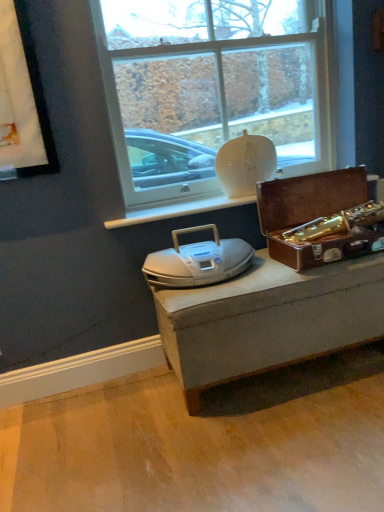
What do you see at coordinates (320, 218) in the screenshot?
I see `shiny brown suitcase at right` at bounding box center [320, 218].

Image resolution: width=384 pixels, height=512 pixels. Identify the location of white matte vase at upper center. (211, 88).

Locate an element on the screen. shiny brown suitcase at right is located at coordinates (320, 218).

Is there a large distance between white plastic stereo at center and white matte vase at upper center?

Actually, white plastic stereo at center and white matte vase at upper center are a little close together.

Is white matte vase at upper center completely or partially inside white plastic stereo at center?

Definitely not — white matte vase at upper center is not inside white plastic stereo at center.

Does point (227, 243) come behind point (248, 4)?

No, (227, 243) is closer to viewer.

Is white plastic stereo at center at the left side of white matte vase at upper center?

Yes, white plastic stereo at center is to the left of white matte vase at upper center.

Do you think shiny brown suitcase at right is within white plastic stereo at center, or outside of it?

shiny brown suitcase at right is not inside white plastic stereo at center, it's outside.

In terms of width, does shiny brown suitcase at right look wider or thinner when compared to white plastic stereo at center?

Clearly, shiny brown suitcase at right has more width compared to white plastic stereo at center.

Is shiny brown suitcase at right looking in the opposite direction of white plastic stereo at center?

shiny brown suitcase at right does not have its back to white plastic stereo at center.

Does point (333, 236) come farther from viewer compared to point (242, 258)?

No, (333, 236) is in front of (242, 258).

Is white matte vase at upper center oriented towards shiny brown suitcase at right?

Yes, white matte vase at upper center is oriented towards shiny brown suitcase at right.

Is white matte vase at upper center spatially inside shiny brown suitcase at right, or outside of it?

white matte vase at upper center is spatially situated outside shiny brown suitcase at right.

How different are the orientations of white matte vase at upper center and shiny brown suitcase at right in degrees?

white matte vase at upper center and shiny brown suitcase at right are facing 0.221 degrees away from each other.

Based on the photo, which object is positioned more to the left, white matte vase at upper center or shiny brown suitcase at right?

Positioned to the left is white matte vase at upper center.

Could you tell me if white plastic stereo at center is facing shiny brown suitcase at right?

No.

Is white plastic stereo at center wider than shiny brown suitcase at right?

No.

How much distance is there between white plastic stereo at center and shiny brown suitcase at right?

white plastic stereo at center and shiny brown suitcase at right are 16.26 inches apart.

Image resolution: width=384 pixels, height=512 pixels. What are the coordinates of `window behind the shiny brown suitcase at right` in the screenshot? It's located at (211, 88).

Is shiny brown suitcase at right oriented away from white matte vase at upper center?

No.

From the image's perspective, is shiny brown suitcase at right under white matte vase at upper center?

Yes, from the image's perspective, shiny brown suitcase at right is beneath white matte vase at upper center.

From a real-world perspective, is shiny brown suitcase at right above or below white matte vase at upper center?

In terms of real-world spatial position, shiny brown suitcase at right is below white matte vase at upper center.

From the picture: How many degrees apart are the facing directions of white matte vase at upper center and white plastic stereo at center?

0.337 degrees separate the facing orientations of white matte vase at upper center and white plastic stereo at center.

Considering the sizes of objects white matte vase at upper center and white plastic stereo at center in the image provided, who is taller, white matte vase at upper center or white plastic stereo at center?

white matte vase at upper center.

Which point is more forward, (213,72) or (154,276)?

Point (154,276)

Does white matte vase at upper center lie behind white plastic stereo at center?

Yes, white matte vase at upper center is further from the viewer.

Locate an element on the screen. The width and height of the screenshot is (384, 512). window behind the white plastic stereo at center is located at coordinates (211, 88).

You are a GUI agent. You are given a task and a screenshot of the screen. Output one action in this format:
    pyautogui.click(x=<x>, y=<y>)
    Task: Click on the box positioned vertically above the white plastic stereo at center (from a real-world perspective)
    Image resolution: width=384 pixels, height=512 pixels.
    Given the screenshot: What is the action you would take?
    pyautogui.click(x=320, y=218)

Estimate the real-world distances between objects in this image. Which object is further from shiny brown suitcase at right, white matte vase at upper center or white plastic stereo at center?

white matte vase at upper center lies further to shiny brown suitcase at right than the other object.

From the image, which object appears to be nearer to shiny brown suitcase at right, white plastic stereo at center or white matte vase at upper center?

Among the two, white plastic stereo at center is located nearer to shiny brown suitcase at right.

Which object lies nearer to the anchor point white matte vase at upper center, white plastic stereo at center or shiny brown suitcase at right?

The object closer to white matte vase at upper center is shiny brown suitcase at right.

Estimate the real-world distances between objects in this image. Which object is further from white matte vase at upper center, shiny brown suitcase at right or white plastic stereo at center?

white plastic stereo at center lies further to white matte vase at upper center than the other object.

Considering their positions, is shiny brown suitcase at right positioned further to white plastic stereo at center than white matte vase at upper center?

The object further to white plastic stereo at center is white matte vase at upper center.

Considering their positions, is white matte vase at upper center positioned further to white plastic stereo at center than shiny brown suitcase at right?

The object further to white plastic stereo at center is white matte vase at upper center.

What are the coordinates of `box between white matte vase at upper center and white plastic stereo at center vertically` in the screenshot? It's located at (320, 218).